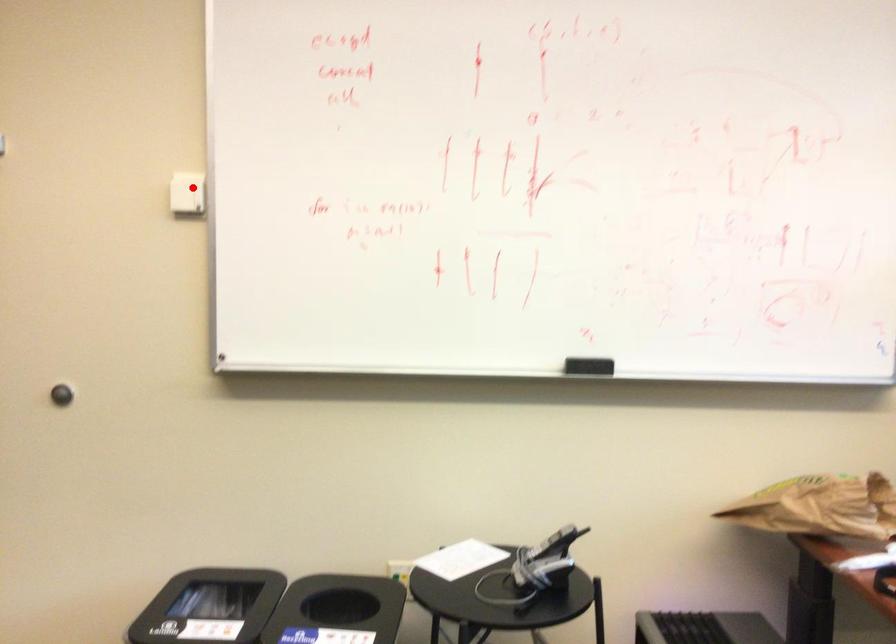
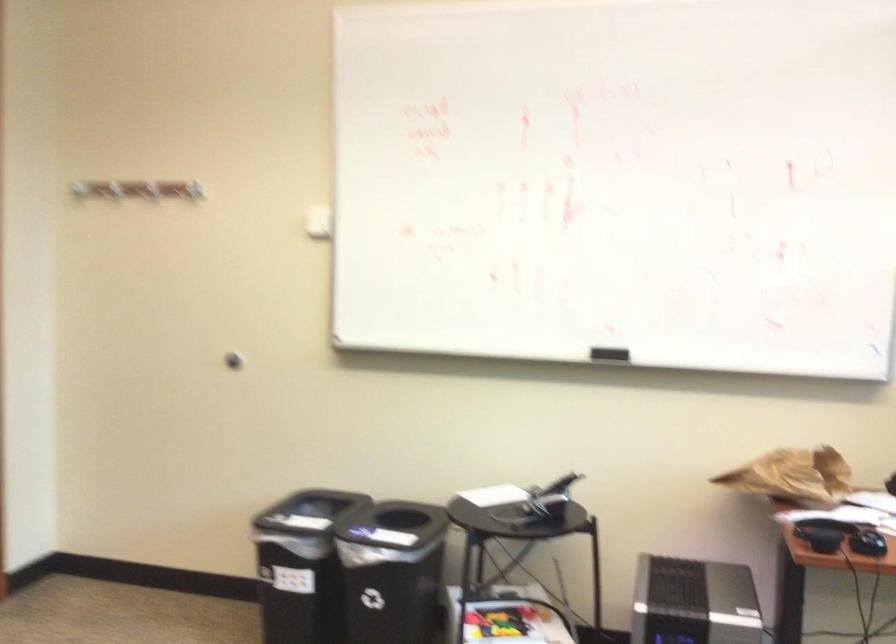
Question: I am providing you with two images of the same scene from different viewpoints. A red point is shown in image1. For the corresponding object point in image2, is it positioned nearer or farther from the camera?

Choices:
 (A) Nearer
 (B) Farther

Answer: (B)